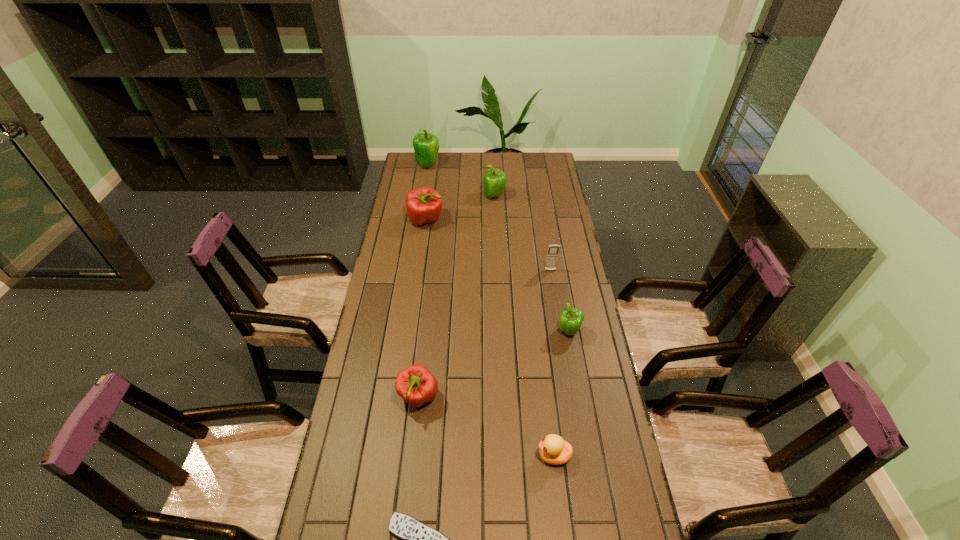
Where is `free space at the right edge of the desktop`? The height and width of the screenshot is (540, 960). free space at the right edge of the desktop is located at coordinates (576, 424).

Find the location of a particular element. The width and height of the screenshot is (960, 540). free spot between the rightmost bell pepper and the cellular telephone is located at coordinates (560, 301).

Locate an element on the screen. vacant space that's between the duckling and the gray cellular telephone is located at coordinates (552, 363).

Image resolution: width=960 pixels, height=540 pixels. In order to click on empty location between the second nearest bell pepper and the sixth nearest object in this screenshot , I will do click(497, 276).

Image resolution: width=960 pixels, height=540 pixels. What are the coordinates of `vacant space that is in between the farthest bell pepper and the nearest bell pepper` in the screenshot? It's located at (423, 281).

This screenshot has width=960, height=540. I want to click on free space between the smaller pink bell pepper and the second nearest object, so click(x=487, y=427).

Identify the location of free point between the farther pink bell pepper and the sixth farthest object. (422, 309).

This screenshot has height=540, width=960. Identify the location of vacant area that lies between the second farthest green bell pepper and the sixth nearest object. (460, 208).

The width and height of the screenshot is (960, 540). I want to click on empty space that is in between the tallest object and the second nearest bell pepper, so click(498, 248).

Identify the location of object that ranks as the sixth closest to the leftmost green bell pepper. (553, 450).